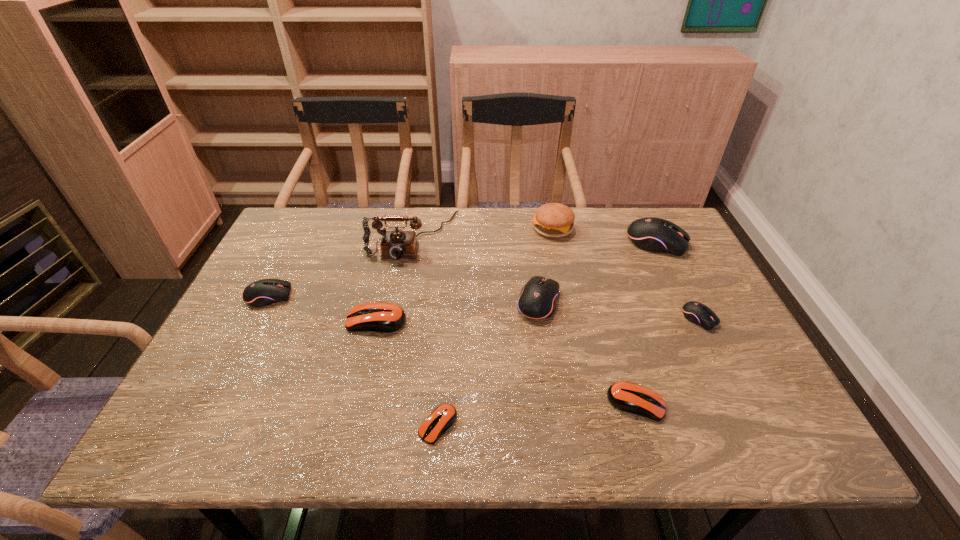
Where is `the smallest black computer mouse`? This screenshot has height=540, width=960. the smallest black computer mouse is located at coordinates (698, 313).

Find the location of a particular element. The width and height of the screenshot is (960, 540). the second smallest orange computer mouse is located at coordinates (628, 397).

I want to click on the rightmost orange computer mouse, so click(628, 397).

At what (x,y) coordinates should I click in order to perform the action: click on the shortest object. Please return your answer as a coordinate pair (x, y). Looking at the image, I should click on (443, 417).

You are a GUI agent. You are given a task and a screenshot of the screen. Output one action in this format:
    pyautogui.click(x=<x>, y=<y>)
    Task: Click on the fifth computer mouse from right to left
    
    Given the screenshot: What is the action you would take?
    pyautogui.click(x=443, y=417)

Where is `vacant space located on the dial of the telephone`? The height and width of the screenshot is (540, 960). vacant space located on the dial of the telephone is located at coordinates (404, 280).

Find the location of `blank space located 0.120m on the left of the hamburger`. blank space located 0.120m on the left of the hamburger is located at coordinates (493, 228).

Identify the location of free spot located 0.180m on the left of the farthest computer mouse. Image resolution: width=960 pixels, height=540 pixels. (568, 243).

At what (x,y) coordinates should I click in order to perform the action: click on vacant space located 0.290m on the right of the second tallest computer mouse. Please return your answer as a coordinate pair (x, y). Looking at the image, I should click on (672, 302).

Find the location of a particular element. Image resolution: width=960 pixels, height=540 pixels. free space located on the right of the leftmost black computer mouse is located at coordinates (364, 297).